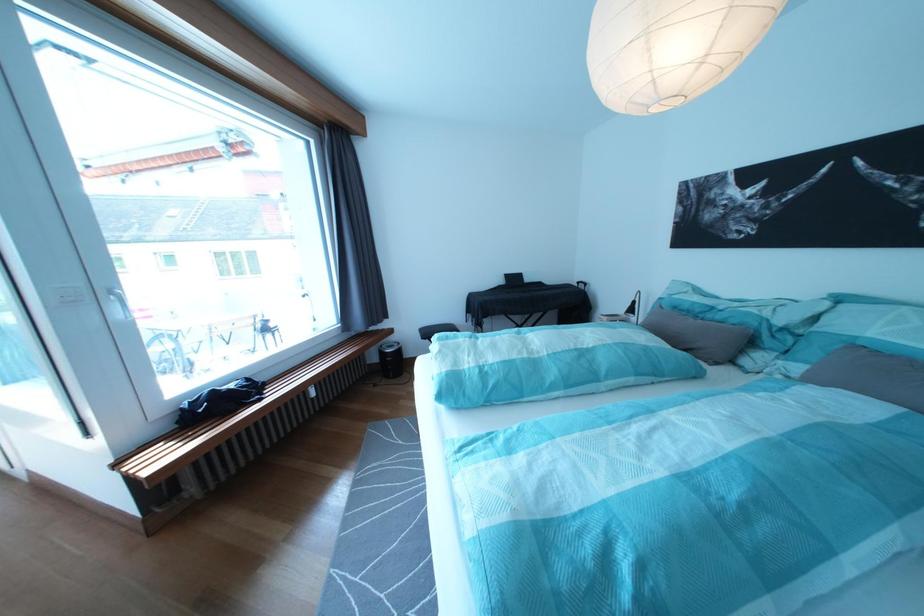
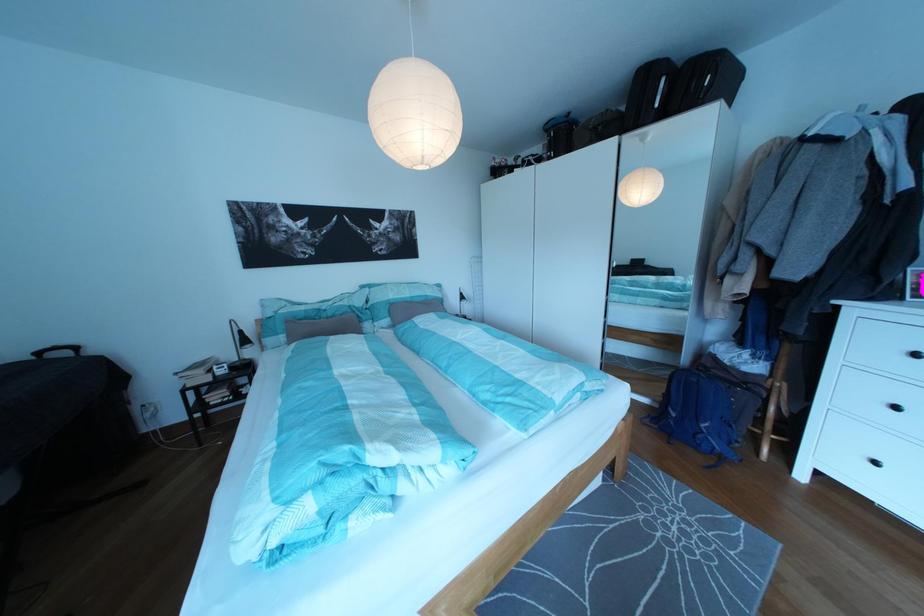
The point at (x=591, y=289) is marked in the first image. Where is the corresponding point in the second image?

(53, 360)